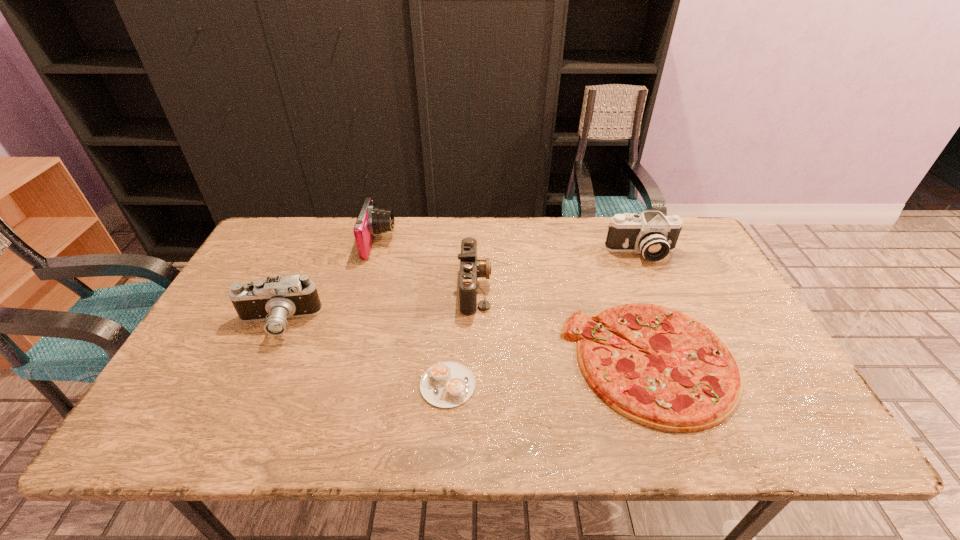
Identify the location of the rightmost camera. Image resolution: width=960 pixels, height=540 pixels. pyautogui.click(x=652, y=234).

I want to click on the third camera from right to left, so click(x=372, y=220).

You are a GUI agent. You are given a task and a screenshot of the screen. Output one action in this format:
    pyautogui.click(x=<x>, y=<y>)
    Task: Click on the leftmost object
    The width and height of the screenshot is (960, 540).
    Given the screenshot: What is the action you would take?
    pyautogui.click(x=274, y=300)

This screenshot has width=960, height=540. I want to click on the second camera from right to left, so click(471, 268).

Find the location of `pizza`. pizza is located at coordinates (687, 379).

At what (x,y) coordinates should I click in order to perform the action: click on cappuccino. Please return your answer as a coordinate pair (x, y). Looking at the image, I should click on (448, 384).

The image size is (960, 540). I want to click on free location located 0.080m on the back of the rightmost camera, so click(630, 227).

Locate an element on the screen. The width and height of the screenshot is (960, 540). vacant area situated on the front-facing side of the third camera from right to left is located at coordinates (506, 244).

I want to click on free space located 0.220m at the lens of the leftmost camera, so click(231, 421).

Where is `blank space located on the front-facing side of the second camera from right to left`? The width and height of the screenshot is (960, 540). blank space located on the front-facing side of the second camera from right to left is located at coordinates (525, 287).